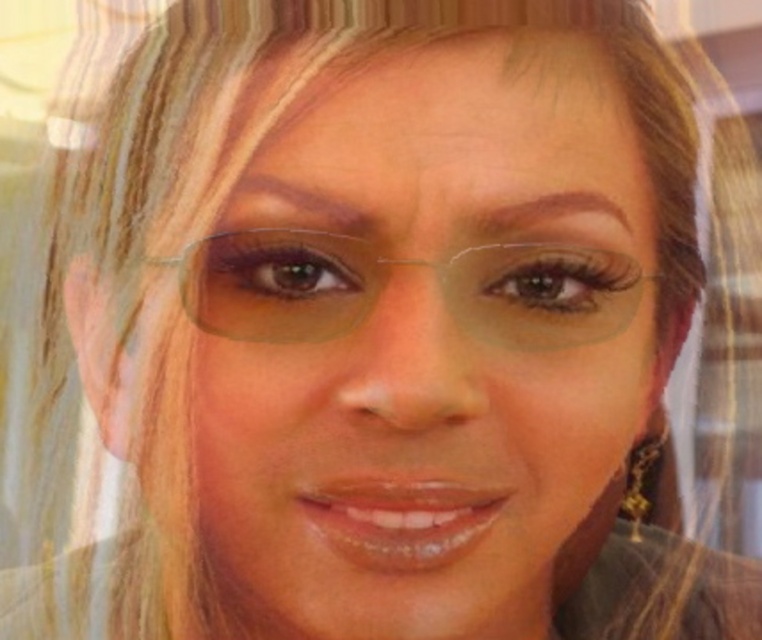
Which is more to the right, clear plastic glasses at center or gold metallic earring at lower right?

From the viewer's perspective, gold metallic earring at lower right appears more on the right side.

Who is taller, clear plastic glasses at center or gold metallic earring at lower right?

Standing taller between the two is gold metallic earring at lower right.

Who is more forward, (556, 326) or (644, 451)?

Point (556, 326) is in front.

Find the location of `clear plastic glasses at center`. clear plastic glasses at center is located at coordinates (386, 282).